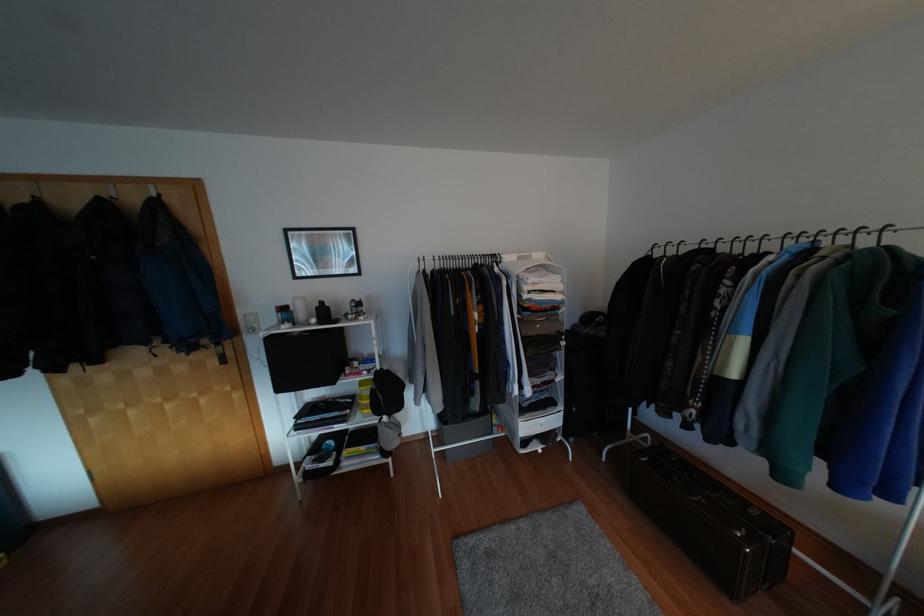
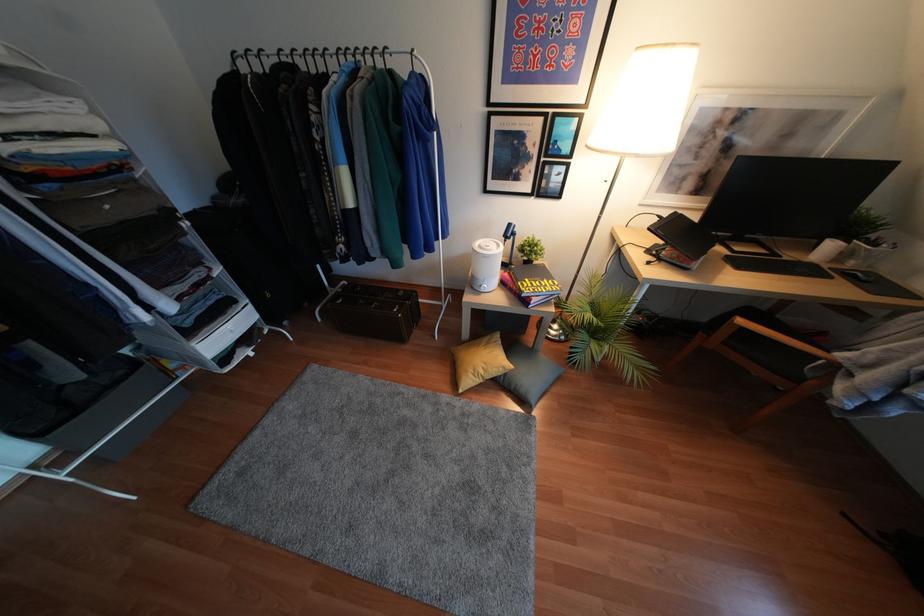
Find the pixel in the second image that matches point (788, 241) in the first image.

(342, 59)